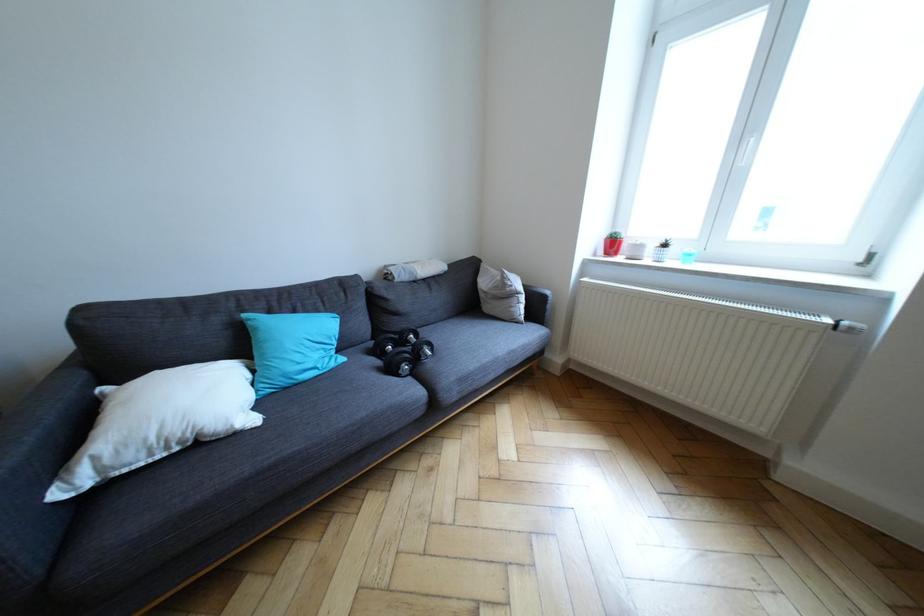
Which object does [290,347] point to?

It refers to a blue pillow.